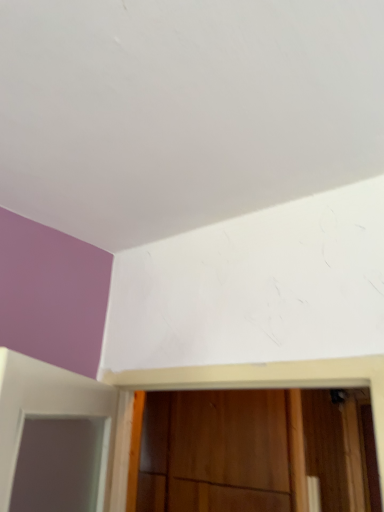
Image resolution: width=384 pixels, height=512 pixels. Identify the location of wooden at center. (214, 452).

This screenshot has height=512, width=384. What do you see at coordinates (214, 452) in the screenshot?
I see `wooden at center` at bounding box center [214, 452].

What is the approximate width of wooden at center?

The width of wooden at center is 60.89 centimeters.

Where is `wooden at center`? wooden at center is located at coordinates (214, 452).